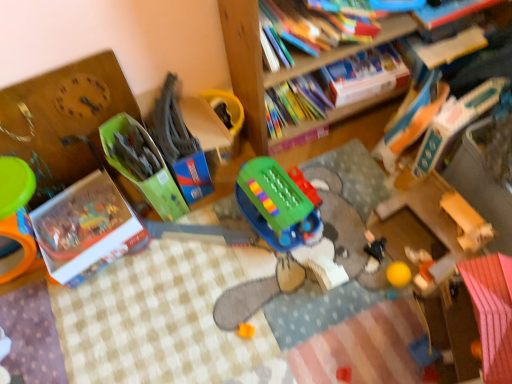
The image size is (512, 384). I want to click on free area behind orange matte cube at center, the 4th toy viewed from the right, so click(238, 283).